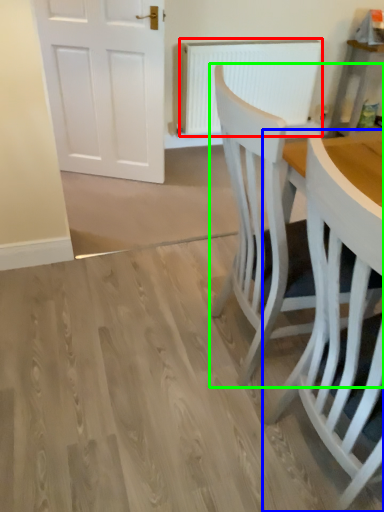
Question: Which object is positioned closest to radiator (highlighted by a red box)? Select from chair (highlighted by a blue box) and chair (highlighted by a green box).

Choices:
 (A) chair
 (B) chair

Answer: (B)